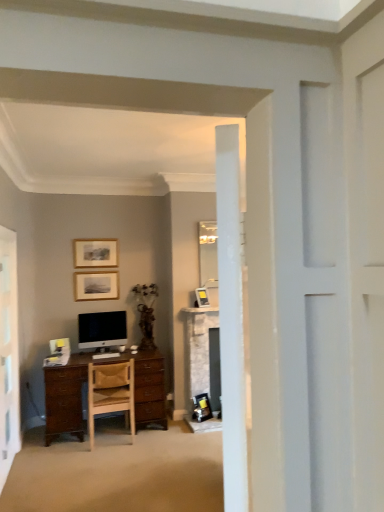
Question: Is wooden picture frame at upper center, the first picture frame when ordered from left to right, wider than white glossy screen door at left?

Choices:
 (A) no
 (B) yes

Answer: (B)

Question: Is the position of wooden picture frame at upper center, the 3th picture frame from the bottom, less distant than that of white glossy screen door at left?

Choices:
 (A) no
 (B) yes

Answer: (A)

Question: Is wooden picture frame at upper center, the first picture frame from the top, further to camera compared to white glossy screen door at left?

Choices:
 (A) no
 (B) yes

Answer: (B)

Question: Is wooden picture frame at upper center, the 3th picture frame from the bottom, shorter than white glossy screen door at left?

Choices:
 (A) yes
 (B) no

Answer: (A)

Question: Is wooden picture frame at upper center, the first picture frame from the top, aimed at white glossy screen door at left?

Choices:
 (A) yes
 (B) no

Answer: (B)

Question: Is wooden picture frame at upper center, the first picture frame from the top, to the left of white glossy screen door at left from the viewer's perspective?

Choices:
 (A) yes
 (B) no

Answer: (B)

Question: Considering the relative positions of white glossy screen door at left and satin black monitor at center in the image provided, is white glossy screen door at left in front of satin black monitor at center?

Choices:
 (A) no
 (B) yes

Answer: (B)

Question: Considering the relative sizes of white glossy screen door at left and satin black monitor at center in the image provided, is white glossy screen door at left bigger than satin black monitor at center?

Choices:
 (A) no
 (B) yes

Answer: (B)

Question: Is white glossy screen door at left outside satin black monitor at center?

Choices:
 (A) no
 (B) yes

Answer: (B)

Question: From the image's perspective, is white glossy screen door at left below satin black monitor at center?

Choices:
 (A) no
 (B) yes

Answer: (B)

Question: From a real-world perspective, is white glossy screen door at left beneath satin black monitor at center?

Choices:
 (A) no
 (B) yes

Answer: (B)

Question: Is white glossy screen door at left at the right side of satin black monitor at center?

Choices:
 (A) no
 (B) yes

Answer: (A)

Question: From a real-world perspective, is wooden picture frame at upper center, the 3th picture frame from the bottom, over matte silver picture frame at center, arranged as the third picture frame when viewed from the left?

Choices:
 (A) yes
 (B) no

Answer: (A)